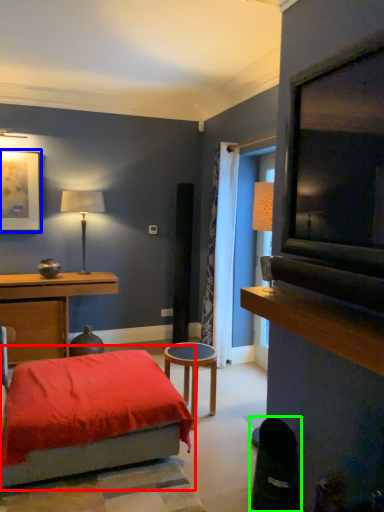
Question: Which is nearer to the bed (highlighted by a red box)? picture frame (highlighted by a blue box) or swivel chair (highlighted by a green box).

Choices:
 (A) picture frame
 (B) swivel chair

Answer: (B)